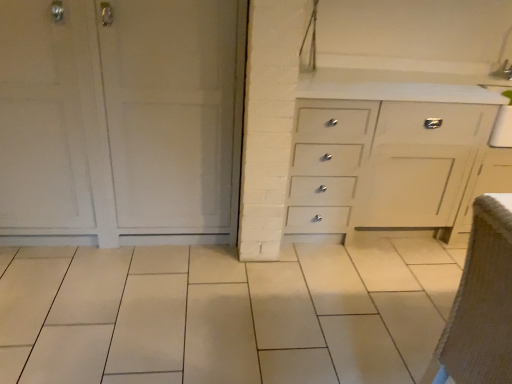
Question: Considering their positions, is brown fabric armchair at lower right located in front of or behind white matte cabinet at left?

Choices:
 (A) behind
 (B) front

Answer: (B)

Question: Would you say brown fabric armchair at lower right is inside or outside white matte cabinet at left?

Choices:
 (A) inside
 (B) outside

Answer: (B)

Question: Considering the positions of brown fabric armchair at lower right and white matte cabinet at left in the image, is brown fabric armchair at lower right bigger or smaller than white matte cabinet at left?

Choices:
 (A) big
 (B) small

Answer: (B)

Question: Considering their positions, is white matte cabinet at left located in front of or behind brown fabric armchair at lower right?

Choices:
 (A) front
 (B) behind

Answer: (B)

Question: From their relative heights in the image, would you say white matte cabinet at left is taller or shorter than brown fabric armchair at lower right?

Choices:
 (A) tall
 (B) short

Answer: (A)

Question: Is white matte cabinet at left situated inside brown fabric armchair at lower right or outside?

Choices:
 (A) inside
 (B) outside

Answer: (B)

Question: Is point (110, 183) closer or farther from the camera than point (492, 233)?

Choices:
 (A) farther
 (B) closer

Answer: (A)